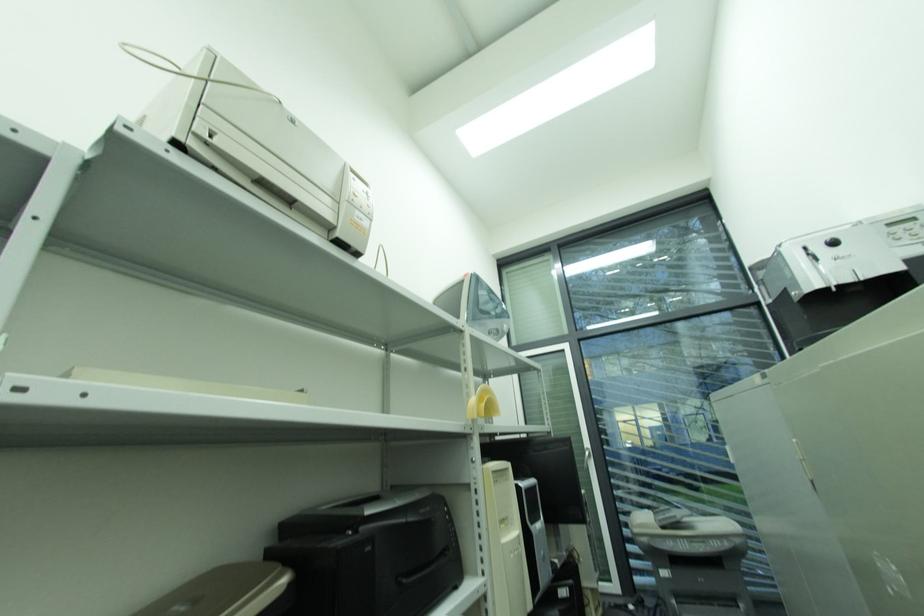
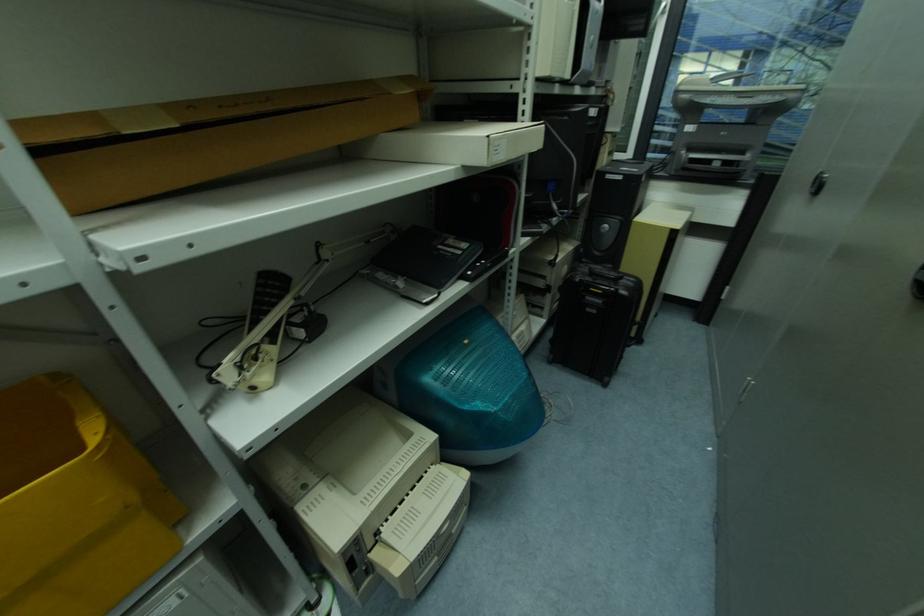
Question: The first image is from the beginning of the video and the second image is from the end. How did the camera likely rotate when shooting the video?

Choices:
 (A) Left
 (B) Right
 (C) Up
 (D) Down

Answer: (D)